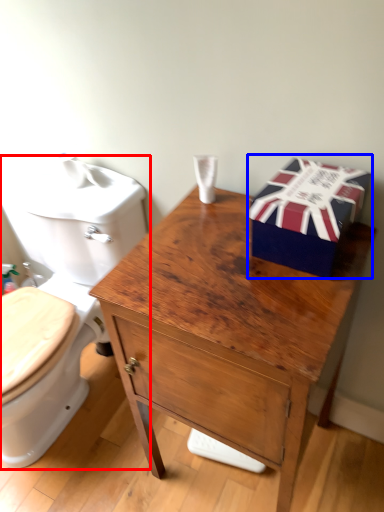
Question: Among these objects, which one is nearest to the camera, toilet (highlighted by a red box) or gift box (highlighted by a blue box)?

Choices:
 (A) toilet
 (B) gift box

Answer: (B)